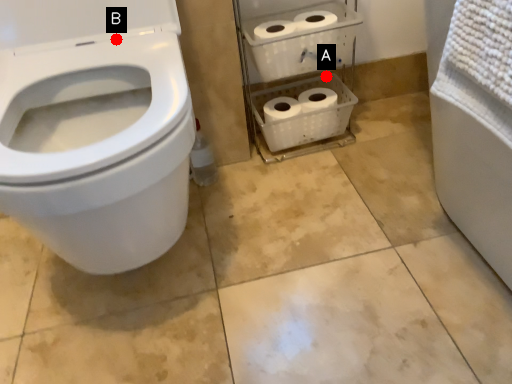
Question: Two points are circled on the image, labeled by A and B beside each circle. Which point is closer to the camera?

Choices:
 (A) A is closer
 (B) B is closer

Answer: (B)